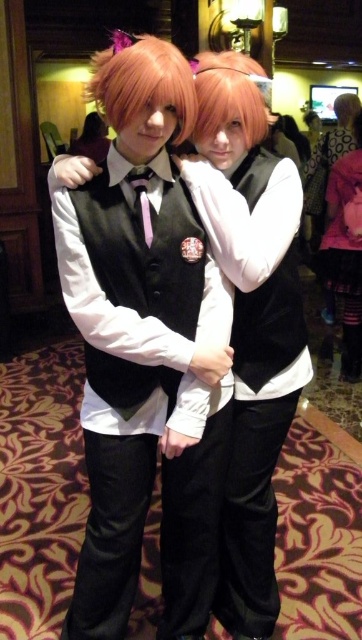
Where is `blonde synthetic wig at center`? Image resolution: width=362 pixels, height=640 pixels. blonde synthetic wig at center is located at coordinates (141, 83).

Does blonde synthetic wig at center have a lesser width compared to matte purple tie at center?

In fact, blonde synthetic wig at center might be wider than matte purple tie at center.

Which is in front, point (119, 113) or point (149, 236)?

Point (119, 113) is in front.

What are the coordinates of `blonde synthetic wig at center` in the screenshot? It's located at (141, 83).

Between pink fabric dress at lower right and matte purple tie at center, which one has less height?

Standing shorter between the two is matte purple tie at center.

Can you confirm if pink fabric dress at lower right is positioned to the left of matte purple tie at center?

In fact, pink fabric dress at lower right is to the right of matte purple tie at center.

Image resolution: width=362 pixels, height=640 pixels. What do you see at coordinates (346, 250) in the screenshot? I see `pink fabric dress at lower right` at bounding box center [346, 250].

Where is `pink fabric dress at lower right`? pink fabric dress at lower right is located at coordinates (346, 250).

Is matte black vest at center below blonde hair at center?

Yes.

Who is more forward, (102, 502) or (226, 68)?

Point (226, 68) is more forward.

At what (x,y) coordinates should I click in order to perform the action: click on matte black vest at center. Please return your answer as a coordinate pair (x, y). The width and height of the screenshot is (362, 640). Looking at the image, I should click on (158, 333).

Where is `matte black vest at center`? Image resolution: width=362 pixels, height=640 pixels. matte black vest at center is located at coordinates (158, 333).